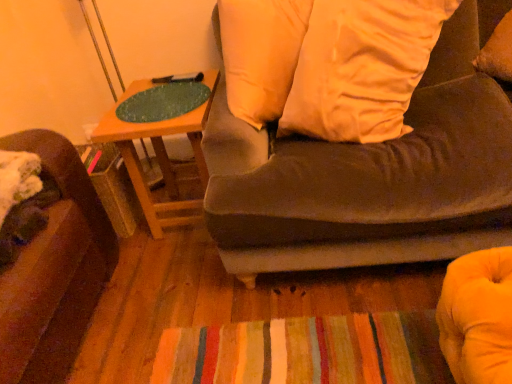
The height and width of the screenshot is (384, 512). What are the coordinates of `green felt at upper left` in the screenshot? It's located at (163, 102).

Consider the image. What is the approximate width of white soft pillow at upper center?

white soft pillow at upper center is 52.26 centimeters in width.

What do you see at coordinates (369, 178) in the screenshot?
I see `suede-like brown couch at upper right` at bounding box center [369, 178].

You are a GUI agent. You are given a task and a screenshot of the screen. Output one action in this format:
    pyautogui.click(x=<x>, y=<y>)
    Task: Click on the suede-like brown couch at upper right
    The image size is (512, 384).
    Given the screenshot: What is the action you would take?
    (x=369, y=178)

This screenshot has width=512, height=384. I want to click on wooden table at upper center, so click(x=140, y=164).

This screenshot has width=512, height=384. I want to click on green felt at upper left, so click(x=163, y=102).

Which of these two, wooden table at upper center or white soft pillow at upper center, stands taller?

white soft pillow at upper center.

Is white soft pillow at upper center at the back of wooden table at upper center?

No, wooden table at upper center is not facing away from white soft pillow at upper center.

Based on the photo, can you confirm if wooden table at upper center is positioned to the left of white soft pillow at upper center?

Indeed, wooden table at upper center is positioned on the left side of white soft pillow at upper center.

Consider the image. From a real-world perspective, relative to white soft pillow at upper center, is wooden table at upper center vertically above or below?

wooden table at upper center is situated lower than white soft pillow at upper center in the real world.

From the image's perspective, does suede-like brown couch at upper right appear lower than white soft pillow at upper center?

Yes, from the image's perspective, suede-like brown couch at upper right is below white soft pillow at upper center.

Considering the positions of point (225, 193) and point (395, 15), is point (225, 193) closer or farther from the camera than point (395, 15)?

Clearly, point (225, 193) is closer to the camera than point (395, 15).

Is suede-like brown couch at upper right facing away from white soft pillow at upper center?

Absolutely, suede-like brown couch at upper right is directed away from white soft pillow at upper center.

Between suede-like brown couch at upper right and white soft pillow at upper center, which one appears on the right side from the viewer's perspective?

suede-like brown couch at upper right.

Does suede-like brown couch at upper right have a greater width compared to green felt at upper left?

Indeed, suede-like brown couch at upper right has a greater width compared to green felt at upper left.

Is suede-like brown couch at upper right far from green felt at upper left?

Actually, suede-like brown couch at upper right and green felt at upper left are a little close together.

Which object is more forward, suede-like brown couch at upper right or green felt at upper left?

suede-like brown couch at upper right is more forward.

From a real-world perspective, is white soft pillow at upper center beneath wooden table at upper center?

No, from a real-world perspective, white soft pillow at upper center is not below wooden table at upper center.

Is white soft pillow at upper center taller than wooden table at upper center?

Yes, white soft pillow at upper center is taller than wooden table at upper center.

Is white soft pillow at upper center positioned before wooden table at upper center?

Yes, it is.

Consider the image. Is white soft pillow at upper center bigger or smaller than wooden table at upper center?

white soft pillow at upper center is bigger than wooden table at upper center.

Is green felt at upper left at the left side of wooden table at upper center?

Yes.

From the image's perspective, which is above, green felt at upper left or wooden table at upper center?

green felt at upper left appears higher in the image.

How many degrees apart are the facing directions of green felt at upper left and wooden table at upper center?

They differ by 0.000358 degrees in their facing directions.

Does green felt at upper left have a greater height compared to wooden table at upper center?

No, green felt at upper left is not taller than wooden table at upper center.

From the image's perspective, which one is positioned lower, green felt at upper left or suede-like brown couch at upper right?

suede-like brown couch at upper right, from the image's perspective.

Is green felt at upper left positioned behind suede-like brown couch at upper right?

Yes, the depth of green felt at upper left is greater than that of suede-like brown couch at upper right.

Can you tell me how much green felt at upper left and suede-like brown couch at upper right differ in facing direction?

green felt at upper left and suede-like brown couch at upper right are facing 1.18 degrees away from each other.

Is green felt at upper left wider than suede-like brown couch at upper right?

In fact, green felt at upper left might be narrower than suede-like brown couch at upper right.

In order to click on table below the suede-like brown couch at upper right (from a real-world perspective) in this screenshot , I will do `click(140, 164)`.

Is wooden table at upper center not within suede-like brown couch at upper right?

Absolutely, wooden table at upper center is external to suede-like brown couch at upper right.

From the image's perspective, does wooden table at upper center appear lower than suede-like brown couch at upper right?

Correct, wooden table at upper center appears lower than suede-like brown couch at upper right in the image.

Where is `table below the white soft pillow at upper center (from a real-world perspective)`? Image resolution: width=512 pixels, height=384 pixels. table below the white soft pillow at upper center (from a real-world perspective) is located at coordinates (140, 164).

Identify the location of studio couch on the right of white soft pillow at upper center. (369, 178).

Which object lies nearer to the anchor point white soft pillow at upper center, suede-like brown couch at upper right or green felt at upper left?

suede-like brown couch at upper right is closer to white soft pillow at upper center.

When comparing their distances from wooden table at upper center, does white soft pillow at upper center or suede-like brown couch at upper right seem further?

white soft pillow at upper center lies further to wooden table at upper center than the other object.

Looking at this image, looking at the image, which one is located further to wooden table at upper center, green felt at upper left or white soft pillow at upper center?

white soft pillow at upper center.

From the image, which object appears to be farther from green felt at upper left, wooden table at upper center or white soft pillow at upper center?

white soft pillow at upper center.

Which object lies further to the anchor point white soft pillow at upper center, wooden table at upper center or green felt at upper left?

wooden table at upper center lies further to white soft pillow at upper center than the other object.

From the image, which object appears to be farther from white soft pillow at upper center, green felt at upper left or suede-like brown couch at upper right?

The object further to white soft pillow at upper center is green felt at upper left.

Looking at the image, which one is located closer to green felt at upper left, white soft pillow at upper center or suede-like brown couch at upper right?

white soft pillow at upper center.

Which object lies nearer to the anchor point wooden table at upper center, white soft pillow at upper center or green felt at upper left?

green felt at upper left is positioned closer to the anchor wooden table at upper center.

Where is `table situated between green felt at upper left and white soft pillow at upper center from left to right`? table situated between green felt at upper left and white soft pillow at upper center from left to right is located at coordinates (140, 164).

Find the location of `pillow between green felt at upper left and suede-like brown couch at upper right`. pillow between green felt at upper left and suede-like brown couch at upper right is located at coordinates (361, 67).

Locate an element on the screen. Image resolution: width=512 pixels, height=384 pixels. pillow between wooden table at upper center and suede-like brown couch at upper right is located at coordinates (361, 67).

The image size is (512, 384). I want to click on table between green felt at upper left and suede-like brown couch at upper right from left to right, so click(x=140, y=164).